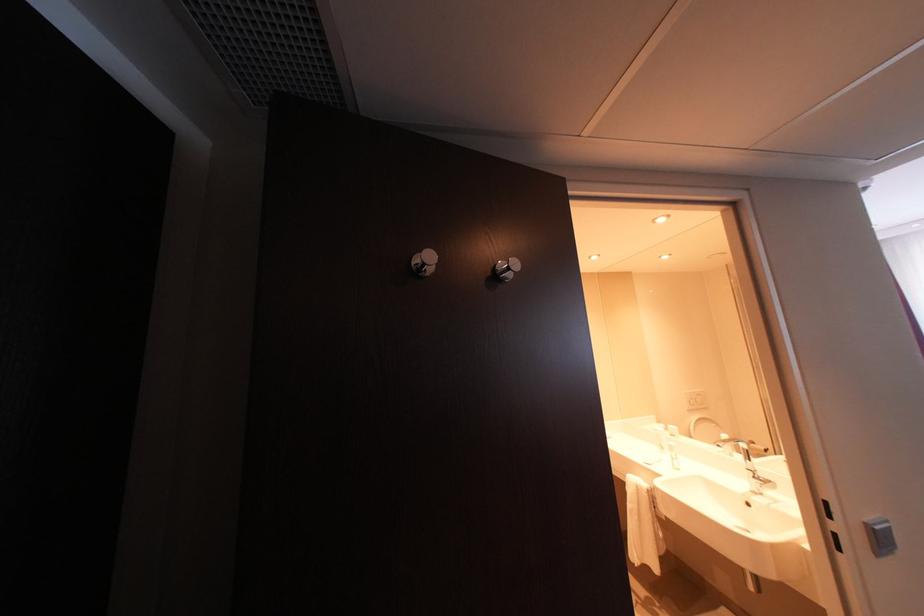
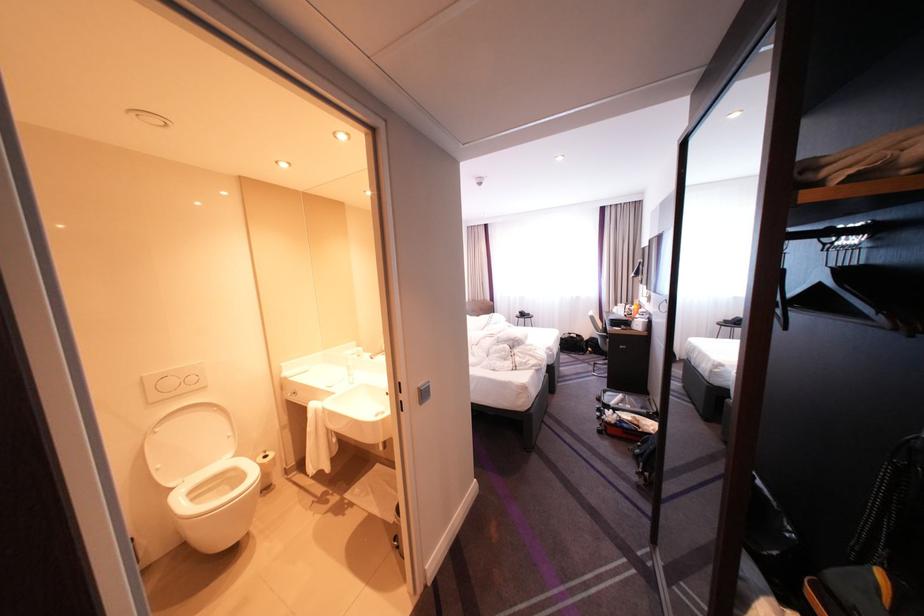
Question: The images are taken continuously from a first-person perspective. In which direction is your viewpoint rotating?

Choices:
 (A) Left
 (B) Right
 (C) Up
 (D) Down

Answer: (B)